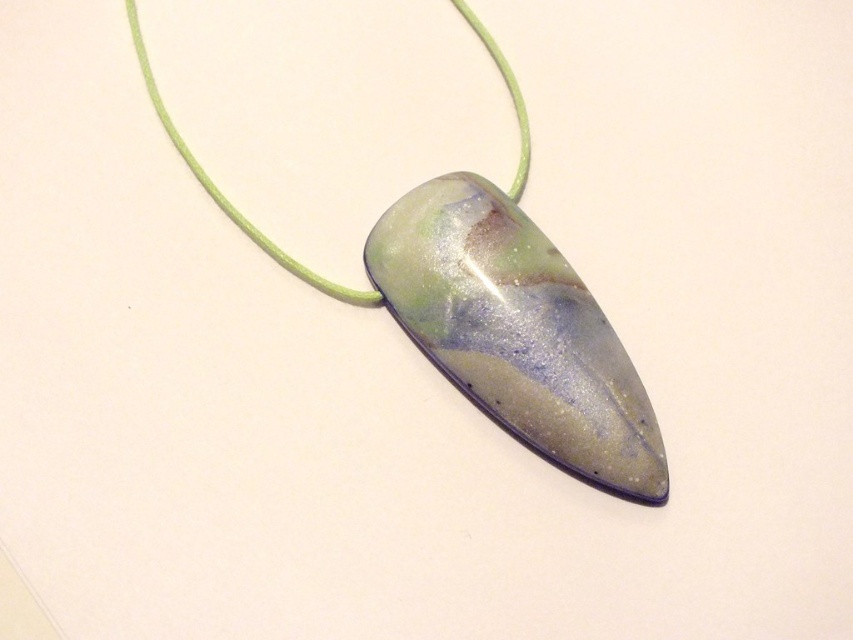
You are an artist trying to sketch the pendant. You need to determine which of the two points, point (633, 499) or point (408, 248), should appear larger in your drawing to accurately represent their depth. Which point should you draw larger?

Point (633, 499) should be drawn larger because it is closer to the camera than point (408, 248), and objects closer to the viewer appear larger in perspective.

You are a jeweler examining two pendants displayed side by side on a white background. You have a customer who wants a pendant that is wider. Which pendant should you recommend between the translucent glass pendant at center and the translucent marbled stone pendant at center?

The translucent glass pendant at center might be wider than the translucent marbled stone pendant at center, so you should recommend the translucent glass pendant at center.

You are a jeweler examining two pendants displayed on a white background. The pendants are the translucent glass pendant at center and the translucent marbled stone pendant at center. Which of these pendants is taller?

The translucent glass pendant at center is much taller than the translucent marbled stone pendant at center.